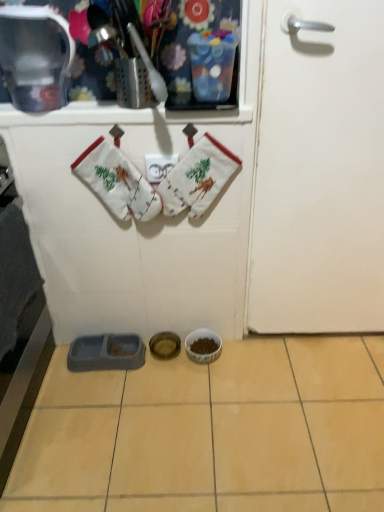
Question: Which is correct: white cotton oven mitts at upper center, marked as the second baby clothe in a right-to-left arrangement, is inside white cotton oven mitts at center, the second baby clothe from the left, or outside of it?

Choices:
 (A) inside
 (B) outside

Answer: (B)

Question: From the image's perspective, is white cotton oven mitts at upper center, positioned as the first baby clothe in left-to-right order, located above or below white cotton oven mitts at center, the second baby clothe from the left?

Choices:
 (A) above
 (B) below

Answer: (B)

Question: Estimate the real-world distances between objects in this image. Which object is closer to the yellow ceramic tile at center?

Choices:
 (A) white cotton oven mitts at upper center, positioned as the first baby clothe in left-to-right order
 (B) white cotton oven mitts at center, acting as the 1th baby clothe starting from the right
 (C) metallic silver container at upper left
 (D) white matte door at right

Answer: (D)

Question: Which is nearer to the white cotton oven mitts at upper center, positioned as the first baby clothe in left-to-right order?

Choices:
 (A) yellow ceramic tile at center
 (B) white cotton oven mitts at center, acting as the 1th baby clothe starting from the right
 (C) metallic silver container at upper left
 (D) white matte door at right

Answer: (B)